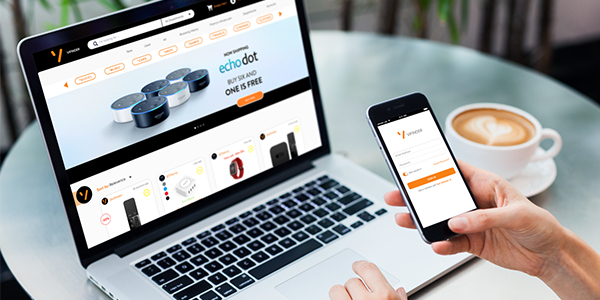
In order to click on laptop in this screenshot , I will do `click(391, 236)`, `click(319, 105)`.